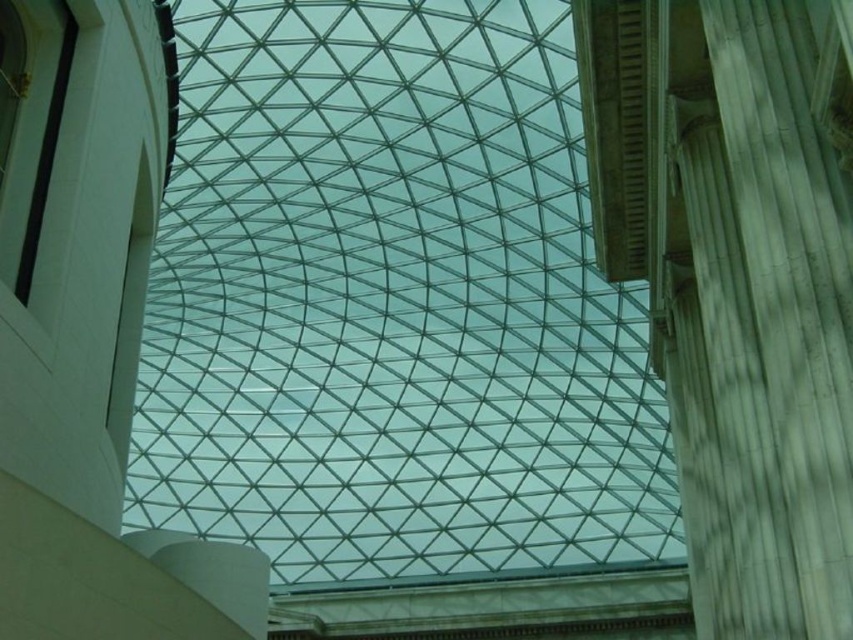
Does transparent glass roof at center have a greater width compared to white marble pillar at right?

Yes, transparent glass roof at center is wider than white marble pillar at right.

Which is more to the right, transparent glass roof at center or white marble pillar at right?

white marble pillar at right is more to the right.

Between point (432, 378) and point (689, 502), which one is positioned in front?

Positioned in front is point (689, 502).

Identify the location of transparent glass roof at center. (392, 304).